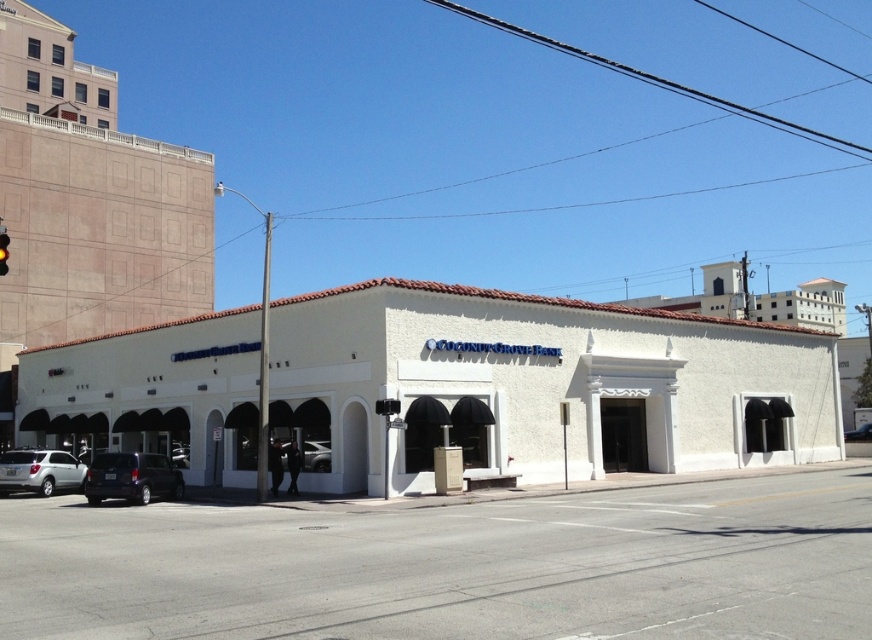
Can you confirm if red glass traffic light at left is positioned above matte black suv at center?

Yes.

Is red glass traffic light at left smaller than matte black suv at center?

No, red glass traffic light at left is not smaller than matte black suv at center.

What do you see at coordinates (3, 248) in the screenshot? I see `red glass traffic light at left` at bounding box center [3, 248].

At what (x,y) coordinates should I click in order to perform the action: click on red glass traffic light at left. Please return your answer as a coordinate pair (x, y). Image resolution: width=872 pixels, height=640 pixels. Looking at the image, I should click on (3, 248).

Is silver metallic suv at lower left to the left of matte black suv at center from the viewer's perspective?

Yes, silver metallic suv at lower left is to the left of matte black suv at center.

Who is more forward, (x=67, y=467) or (x=870, y=433)?

Point (x=67, y=467)

Locate an element on the screen. The image size is (872, 640). silver metallic suv at lower left is located at coordinates (39, 472).

Is point (249, 461) farther from viewer compared to point (1, 269)?

Yes, it is.

What do you see at coordinates (315, 456) in the screenshot?
I see `shiny black sedan at center` at bounding box center [315, 456].

What do you see at coordinates (315, 456) in the screenshot? I see `shiny black sedan at center` at bounding box center [315, 456].

At what (x,y) coordinates should I click in order to perform the action: click on shiny black sedan at center. Please return your answer as a coordinate pair (x, y). The width and height of the screenshot is (872, 640). Looking at the image, I should click on (315, 456).